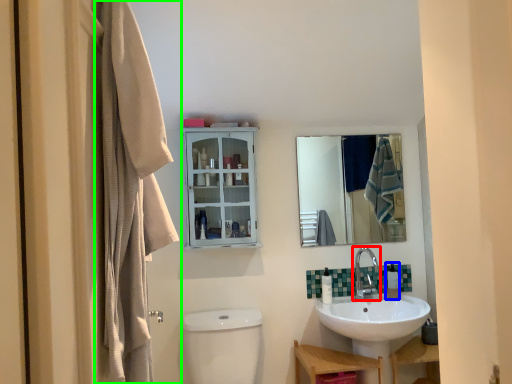
Question: Based on their relative distances, which object is farther from tap (highlighted by a red box)? Choose from toiletry (highlighted by a blue box) and curtain (highlighted by a green box).

Choices:
 (A) toiletry
 (B) curtain

Answer: (B)